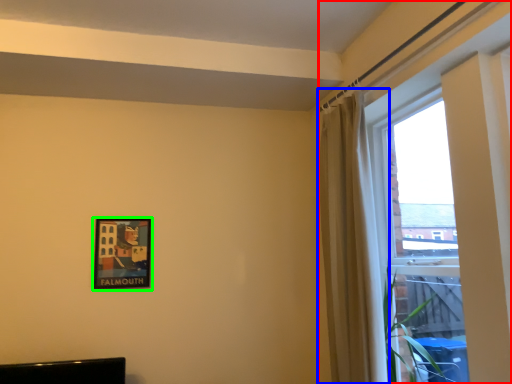
Question: Based on their relative distances, which object is nearer to window (highlighted by a red box)? Choose from curtain (highlighted by a blue box) and picture frame (highlighted by a green box).

Choices:
 (A) curtain
 (B) picture frame

Answer: (A)